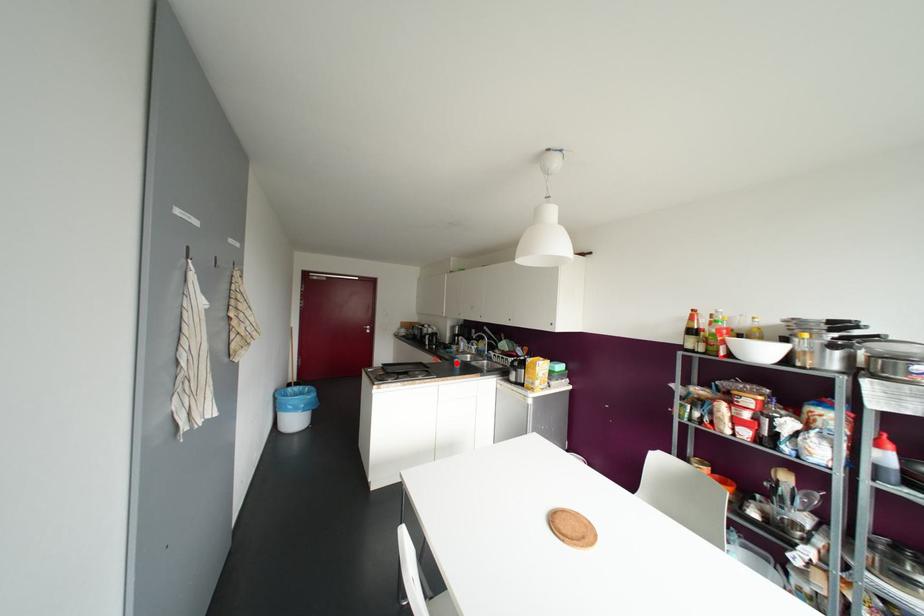
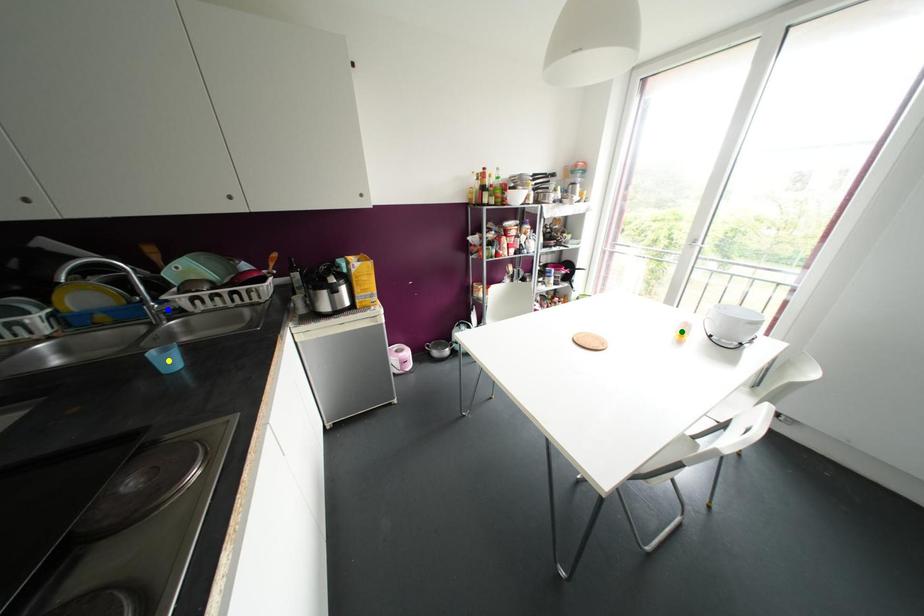
Question: I am providing you with two images of the same scene from different viewpoints. A red point is marked on the first image. You are given multiple points on the second image. Which point in image 2 represents the same 3d spot as the red point in image 1?

Choices:
 (A) yellow point
 (B) blue point
 (C) green point

Answer: (A)